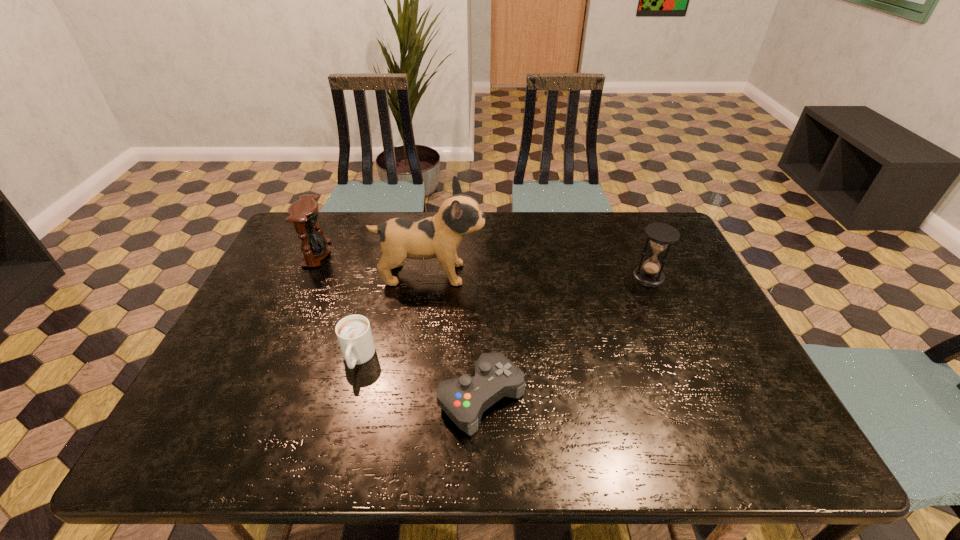
You are a GUI agent. You are given a task and a screenshot of the screen. Output one action in this format:
    pyautogui.click(x=<x>, y=<y>)
    Task: Click on the object that ranks as the third closest to the right hourglass
    This screenshot has height=540, width=960.
    Given the screenshot: What is the action you would take?
    pyautogui.click(x=354, y=334)

Locate which object is the third closest to the rightmost object. Please provide its 2D coordinates. Your answer should be formatted as a tuple, i.e. [(x, y)], where the tuple contains the x and y coordinates of a point satisfying the conditions above.

[(354, 334)]

You are a GUI agent. You are given a task and a screenshot of the screen. Output one action in this format:
    pyautogui.click(x=<x>, y=<y>)
    Task: Click on the vacant area in the image that satisfies the following two spatial constraints: 1. on the side with the handle of the control; 2. on the left side of the second shortest object
    
    Given the screenshot: What is the action you would take?
    pyautogui.click(x=348, y=398)

You are a GUI agent. You are given a task and a screenshot of the screen. Output one action in this format:
    pyautogui.click(x=<x>, y=<y>)
    Task: Click on the free region that satisfies the following two spatial constraints: 1. at the face of the puppy; 2. on the right side of the rightmost object
    
    Given the screenshot: What is the action you would take?
    pyautogui.click(x=430, y=276)

This screenshot has width=960, height=540. What are the coordinates of `blank space that satisfies the following two spatial constraints: 1. at the face of the control; 2. on the right side of the puppy` in the screenshot? It's located at (414, 398).

I want to click on vacant space that satisfies the following two spatial constraints: 1. on the front side of the leftmost object; 2. on the right side of the control, so click(x=252, y=398).

Identify the location of free space that satisfies the following two spatial constraints: 1. on the side with the handle of the second shortest object; 2. on the left side of the control. This screenshot has height=540, width=960. (x=348, y=398).